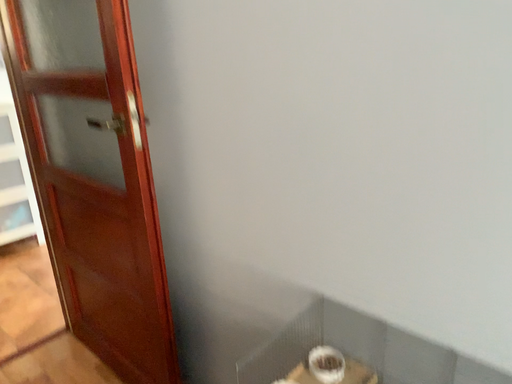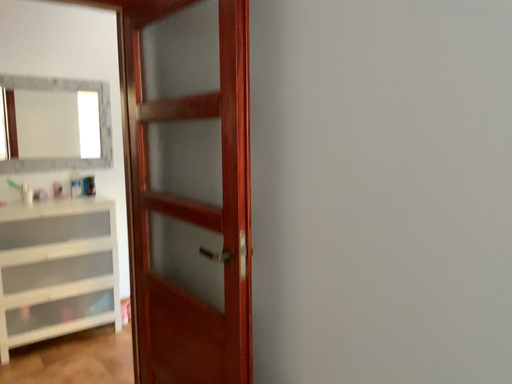
Question: How did the camera likely rotate when shooting the video?

Choices:
 (A) rotated right
 (B) rotated left

Answer: (B)